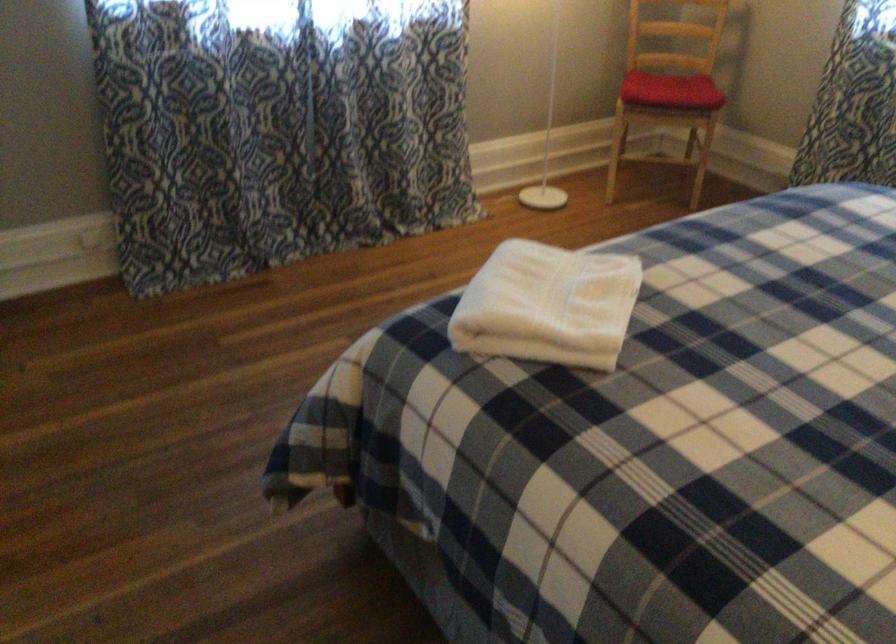
The image size is (896, 644). What do you see at coordinates (670, 90) in the screenshot?
I see `a red chair sitting surface` at bounding box center [670, 90].